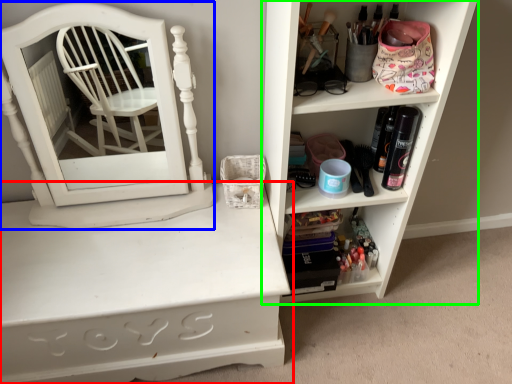
Question: Which object is positioned farthest from shelf (highlighted by a red box)? Select from medicine cabinet (highlighted by a blue box) and shelf (highlighted by a green box).

Choices:
 (A) medicine cabinet
 (B) shelf

Answer: (B)